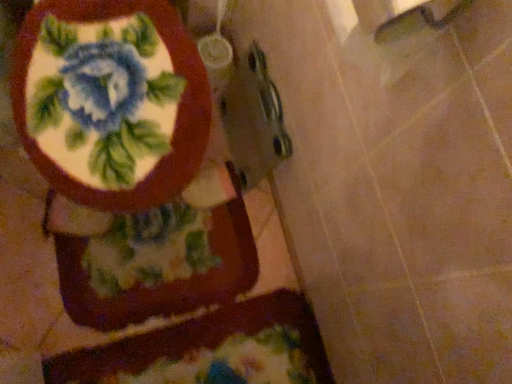
What do you see at coordinates (210, 349) in the screenshot? The height and width of the screenshot is (384, 512). I see `fluffy multicolored bath mat at lower center` at bounding box center [210, 349].

I want to click on fluffy multicolored bath mat at lower center, so click(x=210, y=349).

What is the approximate width of matte ceramic toilet at upper left?

28.73 inches.

The width and height of the screenshot is (512, 384). What are the coordinates of `matte ceramic toilet at upper left` in the screenshot? It's located at (128, 161).

This screenshot has height=384, width=512. What do you see at coordinates (128, 161) in the screenshot?
I see `matte ceramic toilet at upper left` at bounding box center [128, 161].

In order to click on fluffy multicolored bath mat at lower center in this screenshot , I will do `click(210, 349)`.

Consider the image. Is fluffy multicolored bath mat at lower center at the right side of matte ceramic toilet at upper left?

Correct, you'll find fluffy multicolored bath mat at lower center to the right of matte ceramic toilet at upper left.

Is fluffy multicolored bath mat at lower center further to camera compared to matte ceramic toilet at upper left?

Yes.

Does point (304, 378) appear closer or farther from the camera than point (173, 196)?

Clearly, point (304, 378) is more distant from the camera than point (173, 196).

From the image's perspective, relative to matte ceramic toilet at upper left, is fluffy multicolored bath mat at lower center above or below?

fluffy multicolored bath mat at lower center is situated lower than matte ceramic toilet at upper left in the image.

From a real-world perspective, between fluffy multicolored bath mat at lower center and matte ceramic toilet at upper left, who is vertically lower?

fluffy multicolored bath mat at lower center.

Which of these two, fluffy multicolored bath mat at lower center or matte ceramic toilet at upper left, is wider?

With larger width is matte ceramic toilet at upper left.

Between fluffy multicolored bath mat at lower center and matte ceramic toilet at upper left, which one has less height?

fluffy multicolored bath mat at lower center.

Based on the photo, in terms of size, does fluffy multicolored bath mat at lower center appear bigger or smaller than matte ceramic toilet at upper left?

In the image, fluffy multicolored bath mat at lower center appears to be smaller than matte ceramic toilet at upper left.

Is fluffy multicolored bath mat at lower center spatially inside matte ceramic toilet at upper left, or outside of it?

fluffy multicolored bath mat at lower center cannot be found inside matte ceramic toilet at upper left.

Would you say fluffy multicolored bath mat at lower center is a long distance from matte ceramic toilet at upper left?

Actually, fluffy multicolored bath mat at lower center and matte ceramic toilet at upper left are a little close together.

From the picture: Does fluffy multicolored bath mat at lower center turn towards matte ceramic toilet at upper left?

No.

The image size is (512, 384). Identify the location of toilet in front of the fluffy multicolored bath mat at lower center. (128, 161).

Considering the positions of objects matte ceramic toilet at upper left and fluffy multicolored bath mat at lower center in the image provided, who is more to the right, matte ceramic toilet at upper left or fluffy multicolored bath mat at lower center?

From the viewer's perspective, fluffy multicolored bath mat at lower center appears more on the right side.

Between matte ceramic toilet at upper left and fluffy multicolored bath mat at lower center, which one is positioned in front?

Positioned in front is matte ceramic toilet at upper left.

Considering the points (125, 43) and (116, 370), which point is in front, point (125, 43) or point (116, 370)?

The point (125, 43) is closer.

From the image's perspective, which is below, matte ceramic toilet at upper left or fluffy multicolored bath mat at lower center?

fluffy multicolored bath mat at lower center appears lower in the image.

From a real-world perspective, is matte ceramic toilet at upper left above or below fluffy multicolored bath mat at lower center?

In terms of real-world spatial position, matte ceramic toilet at upper left is above fluffy multicolored bath mat at lower center.

Between matte ceramic toilet at upper left and fluffy multicolored bath mat at lower center, which one has larger width?

matte ceramic toilet at upper left.

Who is taller, matte ceramic toilet at upper left or fluffy multicolored bath mat at lower center?

matte ceramic toilet at upper left is taller.

Is matte ceramic toilet at upper left smaller than fluffy multicolored bath mat at lower center?

Incorrect, matte ceramic toilet at upper left is not smaller in size than fluffy multicolored bath mat at lower center.

Is matte ceramic toilet at upper left located outside fluffy multicolored bath mat at lower center?

matte ceramic toilet at upper left lies outside fluffy multicolored bath mat at lower center's area.

Consider the image. Would you consider matte ceramic toilet at upper left to be distant from fluffy multicolored bath mat at lower center?

No.

Is matte ceramic toilet at upper left aimed at fluffy multicolored bath mat at lower center?

Yes, matte ceramic toilet at upper left is aimed at fluffy multicolored bath mat at lower center.

How different are the orientations of matte ceramic toilet at upper left and fluffy multicolored bath mat at lower center in degrees?

matte ceramic toilet at upper left and fluffy multicolored bath mat at lower center are facing 0.000196 degrees away from each other.

Measure the distance from matte ceramic toilet at upper left to fluffy multicolored bath mat at lower center.

They are 15.72 centimeters apart.

Where is `bath mat located below the matte ceramic toilet at upper left (from the image's perspective)`? The image size is (512, 384). bath mat located below the matte ceramic toilet at upper left (from the image's perspective) is located at coordinates (210, 349).

Locate an element on the screen. The height and width of the screenshot is (384, 512). toilet in front of the fluffy multicolored bath mat at lower center is located at coordinates (128, 161).

I want to click on bath mat on the right of matte ceramic toilet at upper left, so pyautogui.click(x=210, y=349).